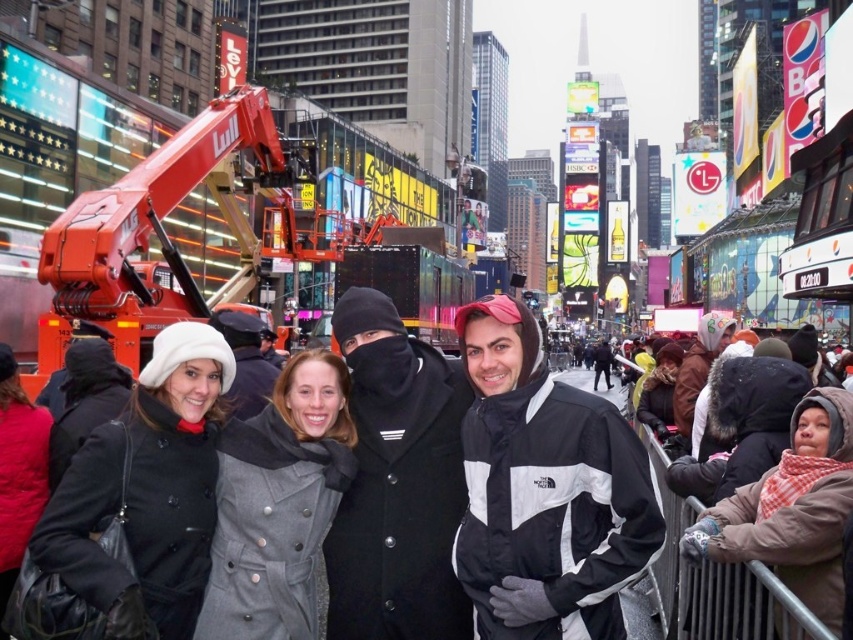
Question: Can you confirm if black/windbreaker jacket at center is wider than brown leather jacket at right?

Choices:
 (A) no
 (B) yes

Answer: (B)

Question: Which point is farther from the camera taking this photo?

Choices:
 (A) (6, 525)
 (B) (241, 323)
 (C) (148, 602)
 (D) (561, 477)

Answer: (B)

Question: Which of these objects is positioned closest to the gray wool coat at center?

Choices:
 (A) matte red coat at lower left
 (B) brown leather jacket at right
 (C) black leather coat at center
 (D) black matte coat at center

Answer: (D)

Question: Which point appears farthest from the camera in this image?

Choices:
 (A) (670, 372)
 (B) (489, 314)
 (C) (310, 451)

Answer: (A)

Question: Is plaid scarf at center bigger than matte red coat at lower left?

Choices:
 (A) no
 (B) yes

Answer: (B)

Question: Can you confirm if black leather coat at center is positioned above brown leather jacket at right?

Choices:
 (A) yes
 (B) no

Answer: (B)